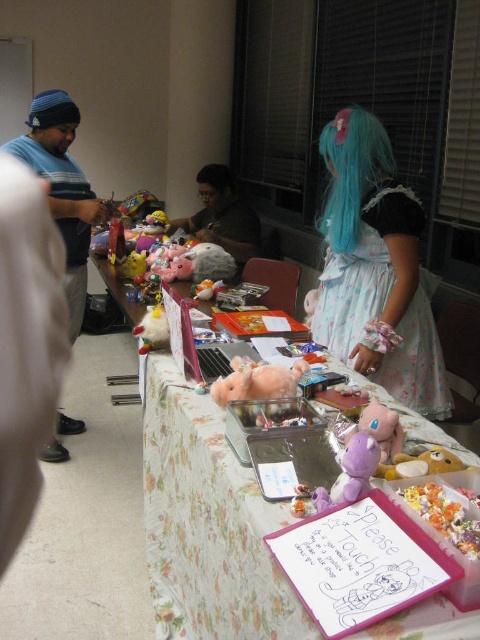
Question: Which point is closer to the camera?

Choices:
 (A) (427, 326)
 (B) (231, 392)
 (C) (61, 93)
 (D) (474, 557)

Answer: (D)

Question: Can you confirm if dark gray shirt at center is smaller than satin silver laptop at center?

Choices:
 (A) no
 (B) yes

Answer: (A)

Question: Which point is farther to the camera?

Choices:
 (A) (350, 481)
 (B) (453, 513)
 (C) (336, 225)
 (D) (166, 328)

Answer: (C)

Question: Which point is farther to the camera?

Choices:
 (A) (49, 108)
 (B) (163, 292)
 (C) (340, 196)

Answer: (A)

Question: From the image, what is the correct spatial relationship of dark gray shirt at center in relation to fluffy pink stuffed animal at center?

Choices:
 (A) right
 (B) left

Answer: (B)

Question: Does blue knit cap at left come in front of white plush toy at center?

Choices:
 (A) yes
 (B) no

Answer: (B)